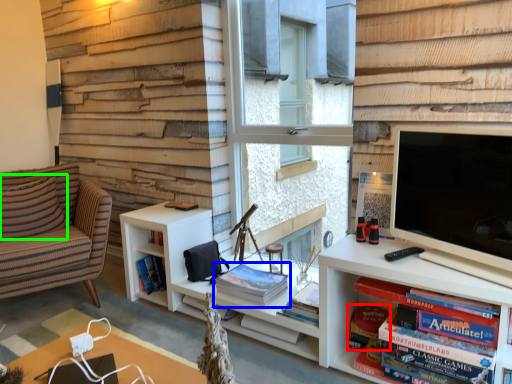
Question: Estimate the real-world distances between objects in this image. Which object is farther from paperback book (highlighted by a red box), book (highlighted by a blue box) or pillow (highlighted by a green box)?

Choices:
 (A) book
 (B) pillow

Answer: (B)